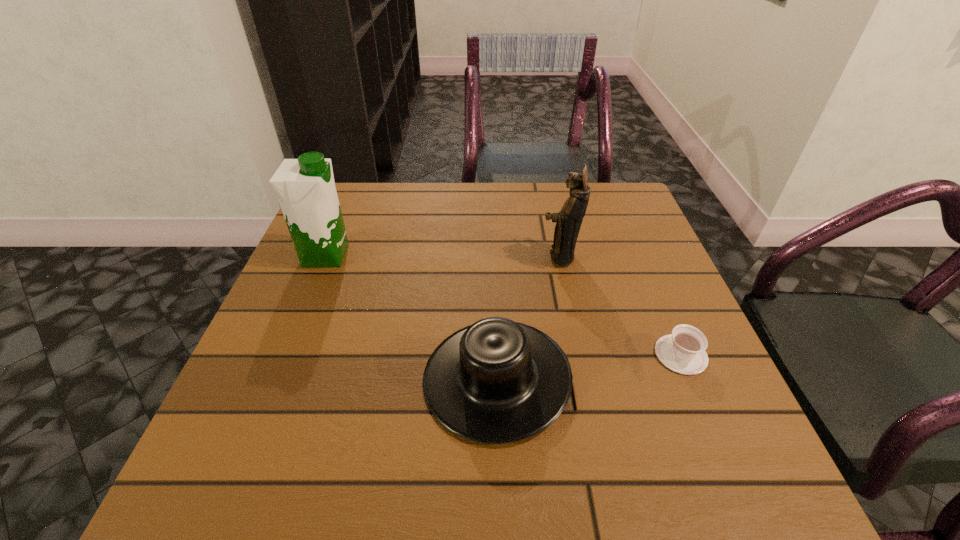
The height and width of the screenshot is (540, 960). Identify the location of vacant space that satisfies the following two spatial constraints: 1. on the front-facing side of the leftmost object; 2. on the back side of the dress hat. (276, 378).

Image resolution: width=960 pixels, height=540 pixels. Identify the location of vacant region that satisfies the following two spatial constraints: 1. on the front-facing side of the dress hat; 2. on the left side of the leftmost object. (276, 378).

Identify the location of vacant area that satisfies the following two spatial constraints: 1. on the front-facing side of the leftmost object; 2. on the handle side of the shortest object. Image resolution: width=960 pixels, height=540 pixels. (285, 355).

Where is `vacant space that satisfies the following two spatial constraints: 1. on the handle side of the teacup; 2. on the front-facing side of the soya milk`? The image size is (960, 540). vacant space that satisfies the following two spatial constraints: 1. on the handle side of the teacup; 2. on the front-facing side of the soya milk is located at coordinates (638, 255).

Where is `vacant space that satisfies the following two spatial constraints: 1. on the back side of the third tallest object; 2. on the front-facing side of the leftmost object`? Image resolution: width=960 pixels, height=540 pixels. vacant space that satisfies the following two spatial constraints: 1. on the back side of the third tallest object; 2. on the front-facing side of the leftmost object is located at coordinates (x=492, y=255).

Where is `vacant area in the image that satisfies the following two spatial constraints: 1. on the handle side of the shortest object; 2. on the front-facing side of the soya milk`? The width and height of the screenshot is (960, 540). vacant area in the image that satisfies the following two spatial constraints: 1. on the handle side of the shortest object; 2. on the front-facing side of the soya milk is located at coordinates [x=638, y=255].

Identify the location of free location that satisfies the following two spatial constraints: 1. on the handle side of the shortest object; 2. on the front-facing side of the soya milk. (638, 255).